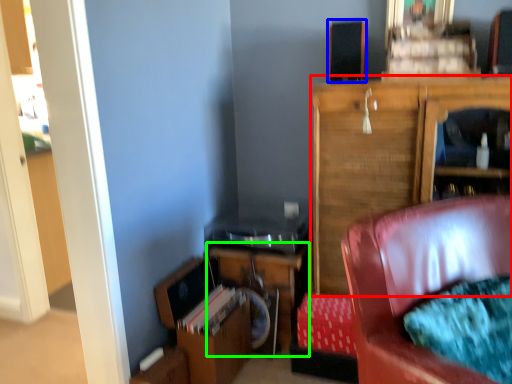
Question: Which object is the closest to the cabinetry (highlighted by a red box)? Choose among these: speaker (highlighted by a blue box) or table (highlighted by a green box).

Choices:
 (A) speaker
 (B) table

Answer: (A)